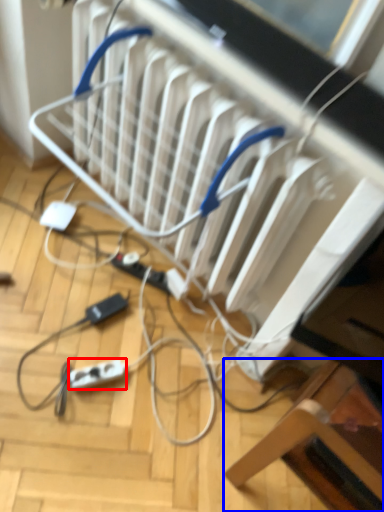
Question: Which object appears closest to the camera in this image, extension cord (highlighted by a red box) or furniture (highlighted by a blue box)?

Choices:
 (A) extension cord
 (B) furniture

Answer: (B)